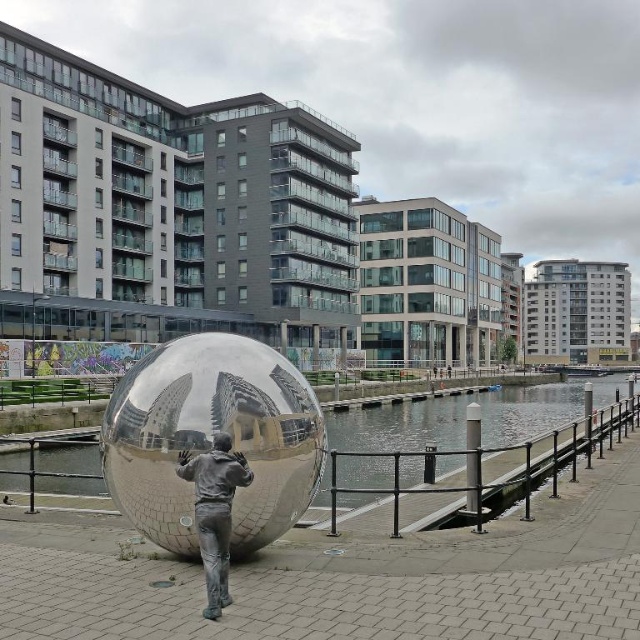
What are the coordinates of the glossy metallic water at center?

The glossy metallic water at center is located at point [464,417].

You are an architect designing a new sculpture garden. You want to place a new sculpture that is 2 meters tall between the glossy metallic water at center and the silver reflective statue at center. Considering their heights, which existing object should the new sculpture be placed closer to?

The glossy metallic water at center is much taller than the silver reflective statue at center. Therefore, the new sculpture that is 2 meters tall should be placed closer to the silver reflective statue at center to maintain a harmonious height arrangement.

You are a maintenance worker who needs to clean both the shiny metallic sphere at center and the silver reflective statue at center. You have a 1.2 meter long extendable pole. Can you reach both objects with the pole without moving your position?

The distance between the shiny metallic sphere at center and the silver reflective statue at center is 44.47 centimeters, which is less than the 1.2 meter length of the pole. Therefore, you can reach both objects with the pole without moving your position.